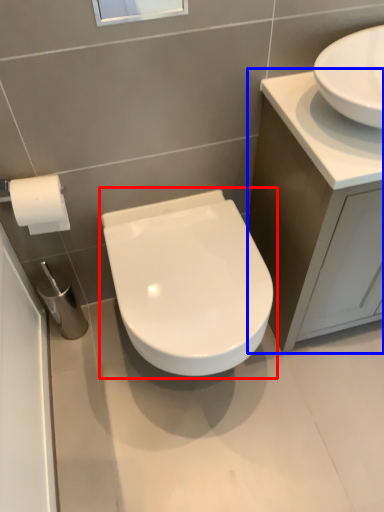
Question: Among these objects, which one is farthest to the camera, toilet (highlighted by a red box) or bathroom cabinet (highlighted by a blue box)?

Choices:
 (A) toilet
 (B) bathroom cabinet

Answer: (A)